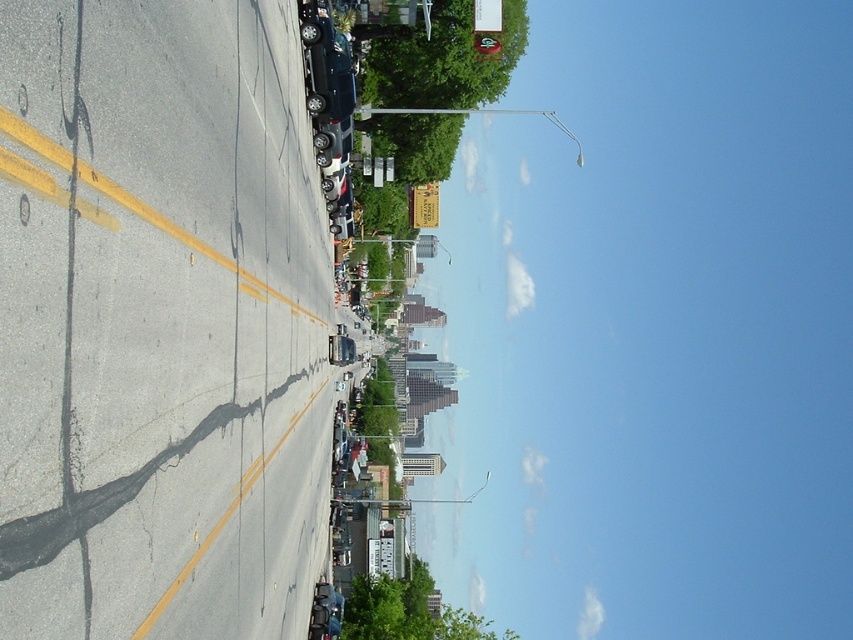
You are a city planner analyzing a street layout. You notice a point labeled as point (225, 516). What is present at this specific coordinate?

Cracked asphalt is present at point (225, 516).

From the picture: You are a city planner analyzing the road condition. The cracked asphalt at center and satin black car at upper center are both visible in the scene. Which object takes up more space in the image?

The cracked asphalt at center takes up more space in the image as it is larger in size than the satin black car at upper center.

You are a delivery drone flying over an urban area and need to land precisely on the asphalt at center. According to the coordinates provided, where should you aim your landing? Please state the coordinates in the format of a point with two decimal places.

The asphalt at center is located at point [160,321]. Therefore, you should aim for coordinates 0.50 and 0.19.